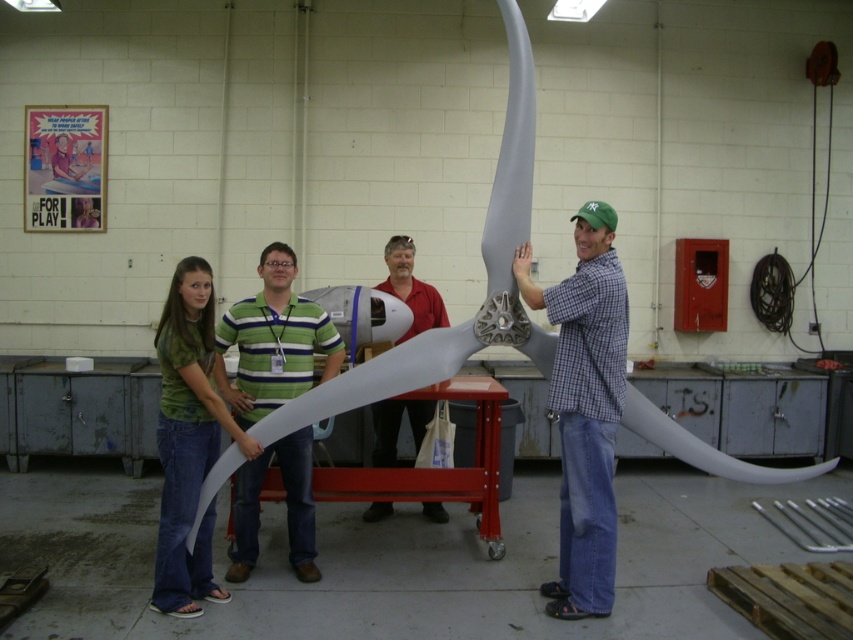
Question: In this image, where is green striped shirt at center located relative to red smooth shirt at center?

Choices:
 (A) right
 (B) left

Answer: (B)

Question: Among these objects, which one is nearest to the camera?

Choices:
 (A) checkered fabric shirt at center
 (B) green matte shirt at center
 (C) red smooth shirt at center
 (D) green striped shirt at center

Answer: (A)

Question: Can you confirm if green matte shirt at center is wider than red smooth shirt at center?

Choices:
 (A) yes
 (B) no

Answer: (A)

Question: Which object is farther from the camera taking this photo?

Choices:
 (A) red smooth shirt at center
 (B) green matte shirt at center
 (C) checkered fabric shirt at center
 (D) green striped shirt at center

Answer: (A)

Question: Observing the image, what is the correct spatial positioning of green striped shirt at center in reference to green matte shirt at center?

Choices:
 (A) below
 (B) above

Answer: (B)

Question: Which point is closer to the camera?

Choices:
 (A) green striped shirt at center
 (B) red smooth shirt at center
 (C) green matte shirt at center

Answer: (C)